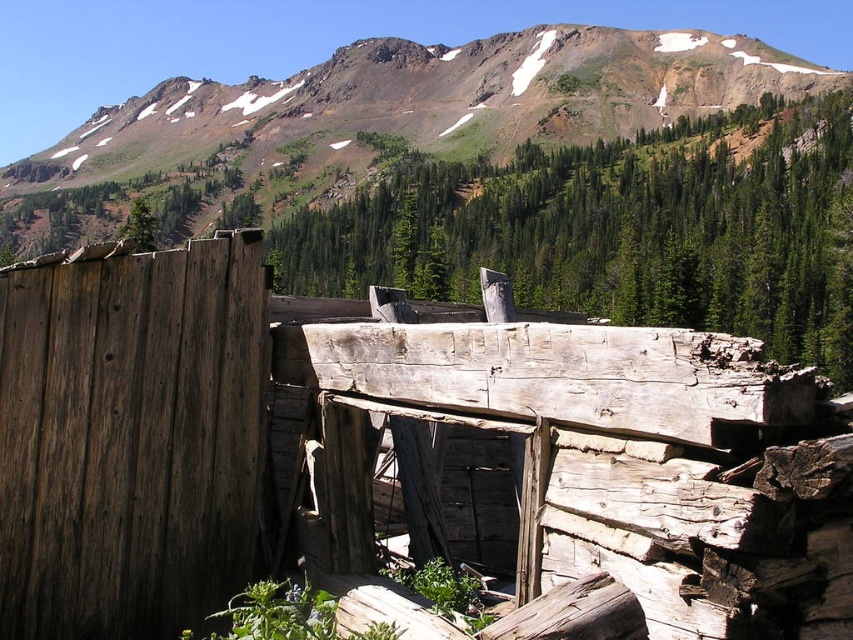
You are a hiker standing at the base of the mountain looking towards the weathered wood fence at left and the dark brown weathered wood at left. Which object is closer to you?

The weathered wood fence at left is closer to you because it is in front of the dark brown weathered wood at left.

You are a hiker planning to cross the rugged brown mountain at upper center and need to pass by the weathered wood fence at left. Which of the two has a smaller width?

The weathered wood fence at left has a lesser width compared to the rugged brown mountain at upper center, so the weathered wood fence at left is narrower.

You are a hiker planning to take a photo of the rugged brown mountain at upper center. There is a weathered wood fence at left in the way. Can you move the fence to get a clear shot?

The weathered wood fence at left occupies less space than rugged brown mountain at upper center, so moving it might allow the mountain to be fully visible without obstruction.